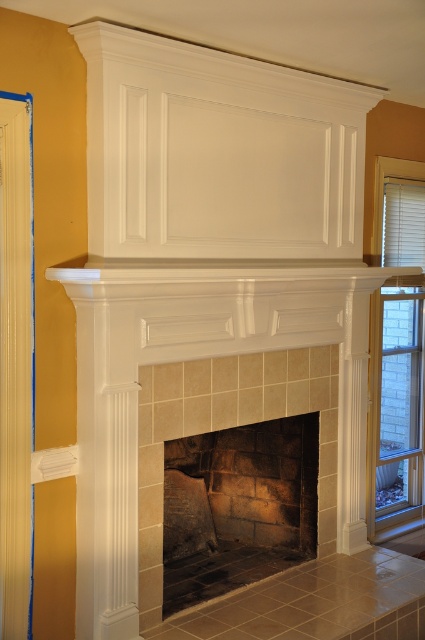
In the scene shown: You are standing in a room with a fireplace. You want to place a decorative item on the mantel. Where exactly should you go to find the dark stone fireplace at center?

The dark stone fireplace at center is located at point (238, 508).

You are standing in a room with a fireplace. There is a point marked at coordinates (238, 508). What object is located at that point?

The dark stone fireplace at center is located at point (238, 508).

You are standing in a living room and see the dark stone fireplace at center and the white blinds at right. Which object is nearer to you?

The dark stone fireplace at center is closer to the viewer than the white blinds at right.